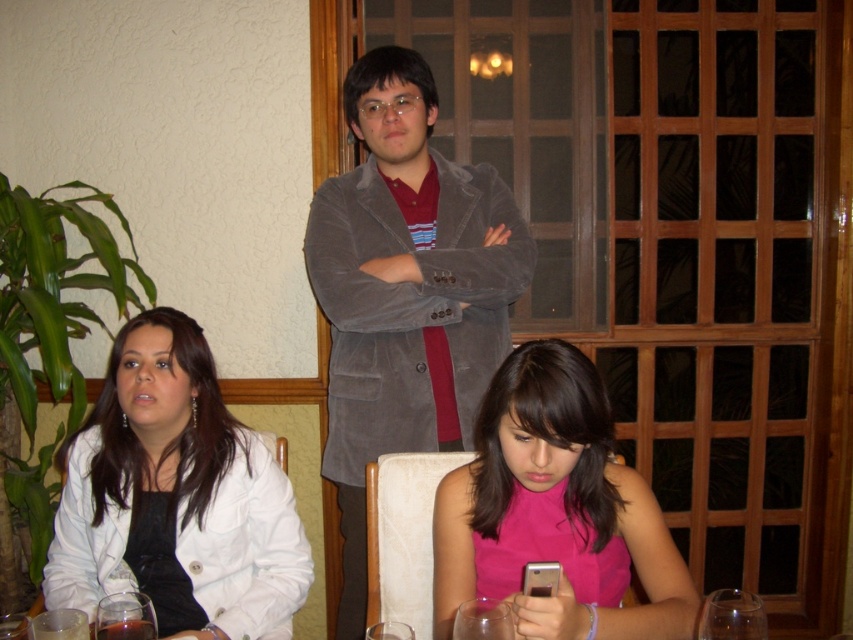
In the scene shown: You are a photographer setting up a shoot in this dining area. You need to decide which garment to use as a backdrop. Since you want the backdrop to be larger than the subject, which of the two items should you choose between the white matte jacket at lower left and the pink satin dress at center?

The white matte jacket at lower left is bigger than the pink satin dress at center, so you should choose the white matte jacket at lower left as the backdrop to ensure it is larger than the subject.

You are a photographer taking a picture of the white matte jacket at lower left and the pink satin dress at center. Which one is positioned to the left of the other?

The white matte jacket at lower left is positioned to the left of the pink satin dress at center.

You are a customer in this restaurant and want to ask the person in the suede blazer at center a question. Which direction should you turn your head to look at them from the white matte jacket at lower left?

The suede blazer at center is further to the viewer than the white matte jacket at lower left, so you should turn your head towards the center direction to look at the suede blazer at center from the white matte jacket at lower left.